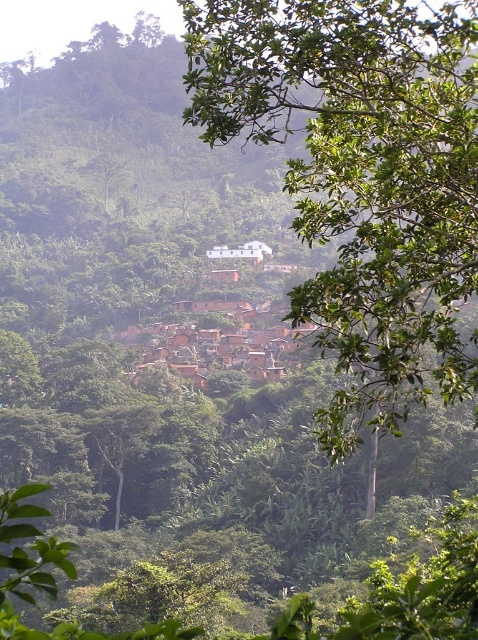
You are a bird flying over the lush landscape. You see the green leafy tree at upper center and the brown clay houses at center. Which one is higher from the ground?

The green leafy tree at upper center is higher from the ground than the brown clay houses at center because it is positioned above them in the scene.

You are a bird flying over the lush landscape. You want to land on the highest point you can see. Which object would you choose between the green leafy tree at upper center and the brown clay houses at center?

The green leafy tree at upper center is much taller than the brown clay houses at center, so the bird should land on the green leafy tree at upper center as it offers the highest point available.

You are a drone operator trying to navigate through the dense tropical vegetation. You need to locate a specific point marked at coordinates (x=361, y=177). Based on the scene description, where is this point located?

The point at coordinates (x=361, y=177) is located on the green leafy tree at upper center.